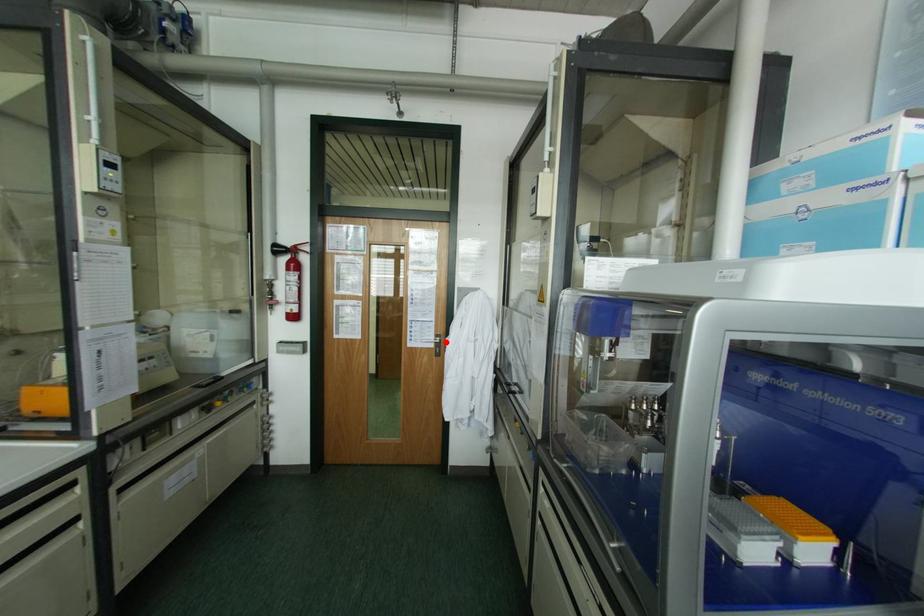
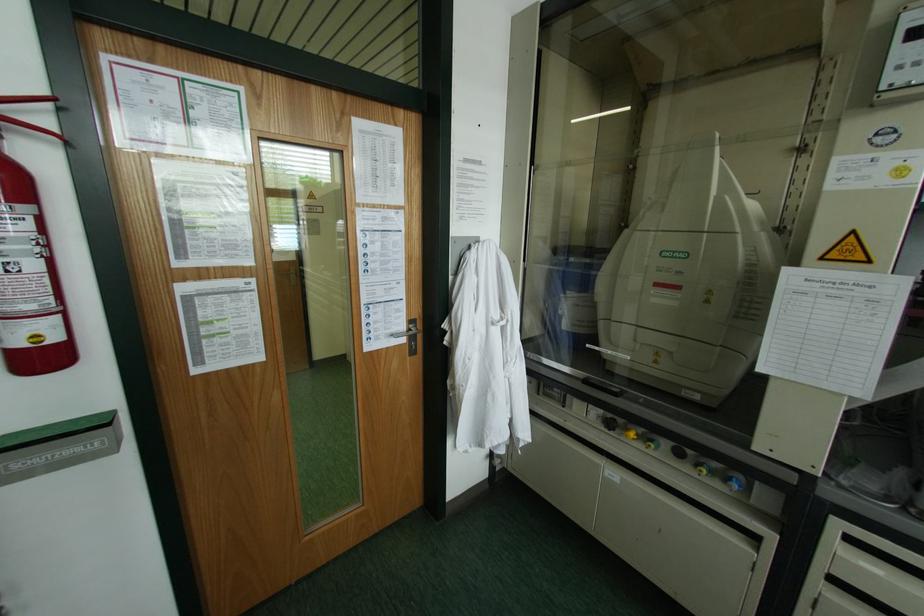
Where in the second image is the point corresponding to the highlighted location from the first image?

(444, 331)